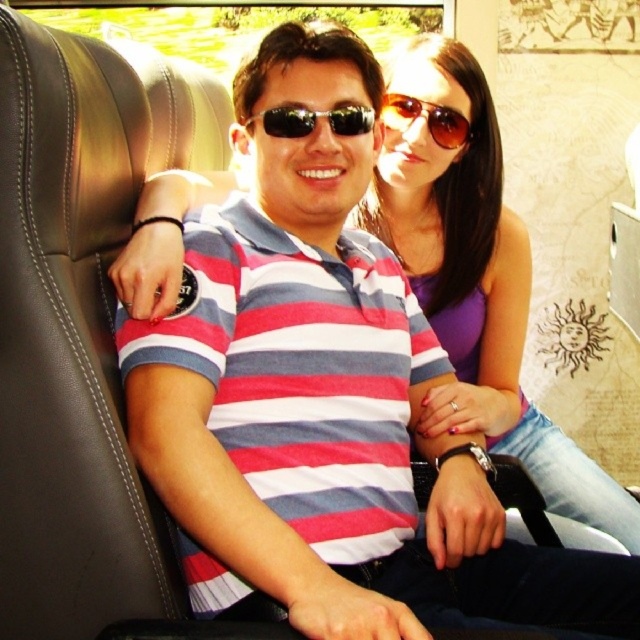
You are a photographer trying to capture a clear photo of both individuals in the vehicle. Given their positions at point (301, 108) and point (428, 102), which person should you focus on first to ensure both are in focus?

Point (301, 108) is in front of point (428, 102), so you should focus on the person at point (301, 108) first to ensure both are in focus.

You are a photographer trying to capture a clear shot of both the black reflective sunglasses at center and the sunglasses at upper center in the image. Since both are sunglasses, how can you distinguish their positions based on their placement?

The black reflective sunglasses at center is positioned below the sunglasses at upper center, so you can tell them apart by noting that the black reflective pair is lower in the image while the other is higher.

Based on the scene description, where is the black reflective sunglasses at center located in terms of its 2D coordinates?

The black reflective sunglasses at center is located at the 2D coordinates of point (314, 120).